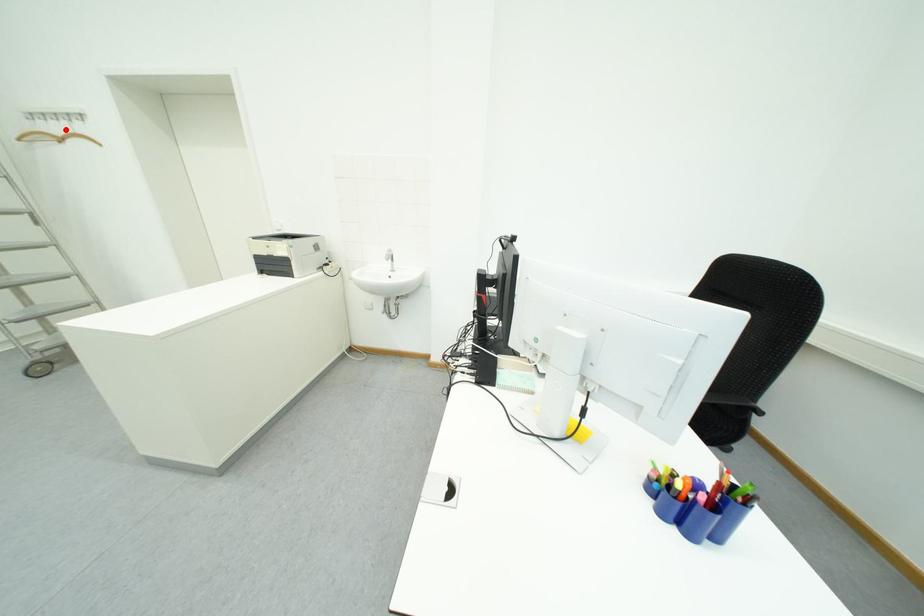
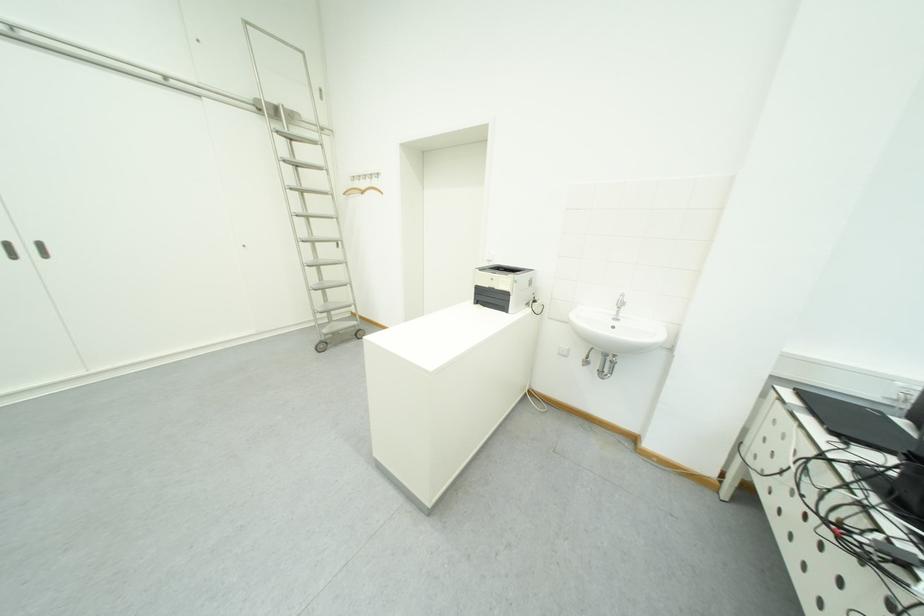
Question: I am providing you with two images of the same scene from different viewpoints. In image1, a red point is highlighted. Considering the same 3D point in image2, which of the following is correct?

Choices:
 (A) It is closer
 (B) It is farther

Answer: (A)